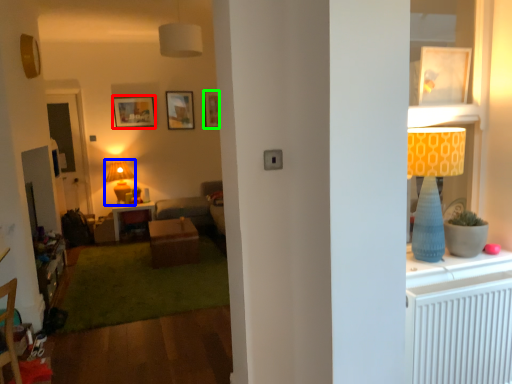
Question: Which is nearer to the picture frame (highlighted by a red box)? lamp (highlighted by a blue box) or picture frame (highlighted by a green box).

Choices:
 (A) lamp
 (B) picture frame

Answer: (A)